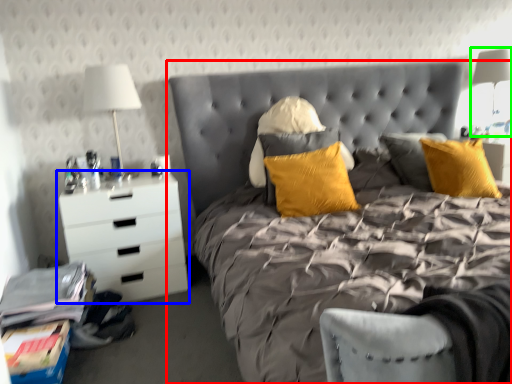
Question: Which object is positioned farthest from bed (highlighted by a red box)? Select from chest of drawers (highlighted by a blue box) and bedside lamp (highlighted by a green box).

Choices:
 (A) chest of drawers
 (B) bedside lamp

Answer: (B)